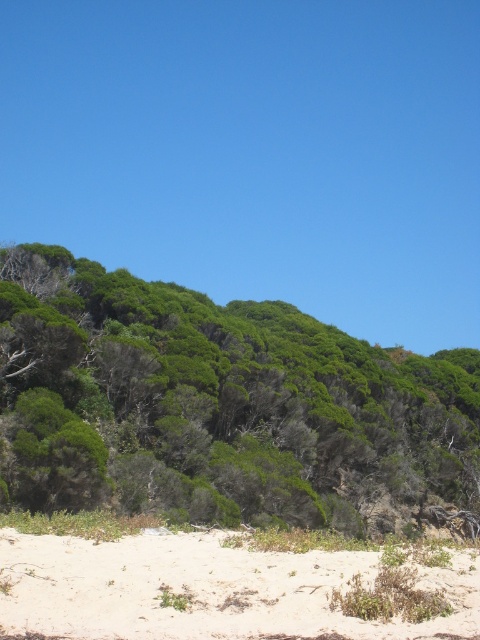
You are a landscape architect designing a walking path. You need to decide between placing it near the green leafy bush at upper center or the white sandy beach at lower center. Which location has a wider area to accommodate the path?

The green leafy bush at upper center might be wider than the white sandy beach at lower center, so it could provide a wider area for the path.

You are standing at the bottom of the hill looking up. You see the green leafy bush at upper center and the white sandy beach at lower center. Which object is closer to you?

The green leafy bush at upper center is closer to you than the white sandy beach at lower center because the white sandy beach at lower center is behind the green leafy bush at upper center.

You are planning to plant a new tree in the white sandy beach at lower center. Considering the size of the green leafy bush at upper center, which is larger than the beach, do you think the beach has enough space for the new tree?

The green leafy bush at upper center is larger in size than the white sandy beach at lower center. Since the beach is smaller, there may not be enough space to plant a new tree there.